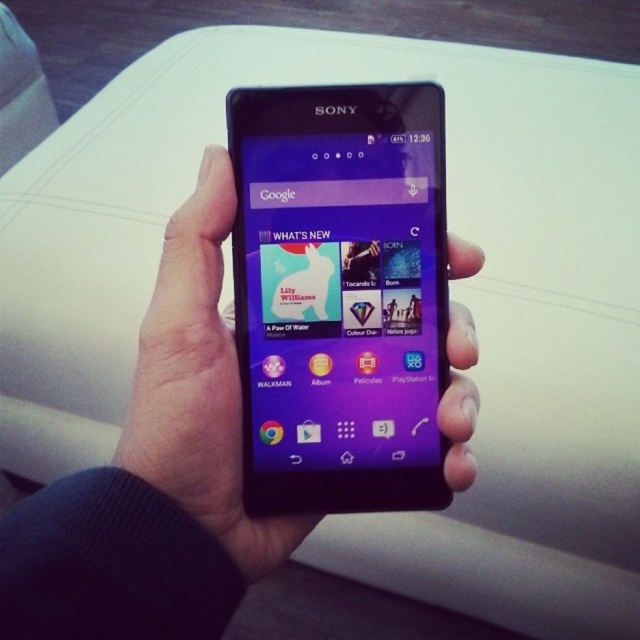
Looking at this image, how far apart are matte black smartphone at center and black matte phone at center?

matte black smartphone at center and black matte phone at center are 1.78 inches apart from each other.

Does matte black smartphone at center have a lesser height compared to black matte phone at center?

Yes, matte black smartphone at center is shorter than black matte phone at center.

What do you see at coordinates (340, 296) in the screenshot?
I see `matte black smartphone at center` at bounding box center [340, 296].

This screenshot has width=640, height=640. I want to click on matte black smartphone at center, so click(x=340, y=296).